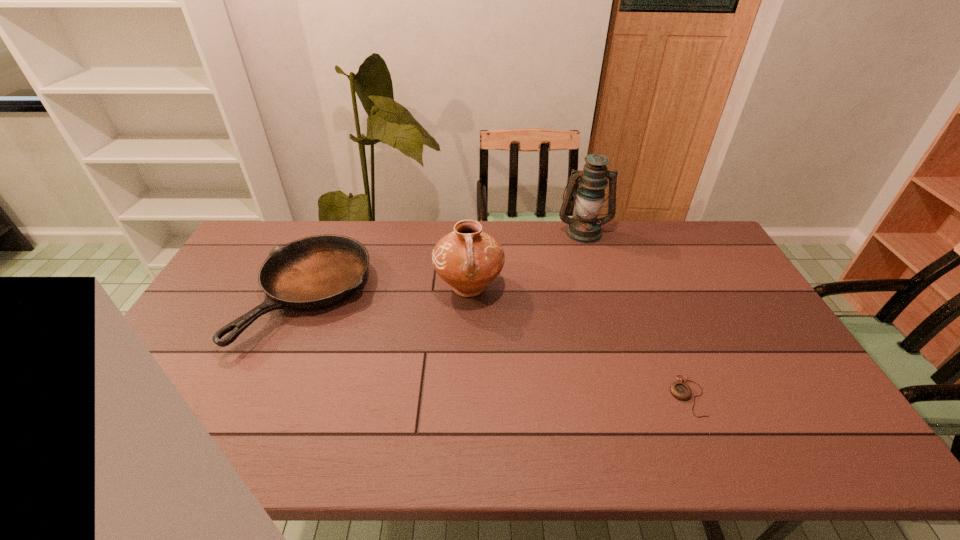
Locate an element on the screen. The image size is (960, 540). free location that satisfies the following two spatial constraints: 1. on the side of the third object from right to left with the handle; 2. on the right side of the nearest object is located at coordinates (466, 396).

Where is `free location that satisfies the following two spatial constraints: 1. on the back side of the frying pan; 2. on the right side of the farthest object`? The height and width of the screenshot is (540, 960). free location that satisfies the following two spatial constraints: 1. on the back side of the frying pan; 2. on the right side of the farthest object is located at coordinates (337, 232).

What are the coordinates of `free space in the image that satisfies the following two spatial constraints: 1. on the side of the pottery with the handle; 2. on the right side of the pocket watch` in the screenshot? It's located at click(466, 396).